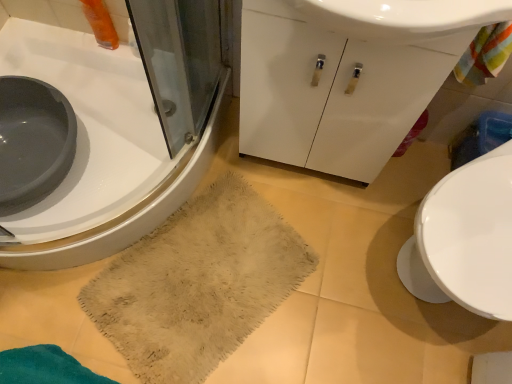
Question: Is white glossy cabinet at center at the back of white glossy sink at lower left?

Choices:
 (A) no
 (B) yes

Answer: (A)

Question: Could you tell me if white glossy sink at lower left is turned towards white glossy cabinet at center?

Choices:
 (A) yes
 (B) no

Answer: (B)

Question: From the image's perspective, is white glossy sink at lower left below white glossy cabinet at center?

Choices:
 (A) yes
 (B) no

Answer: (A)

Question: From a real-world perspective, is white glossy sink at lower left below white glossy cabinet at center?

Choices:
 (A) yes
 (B) no

Answer: (A)

Question: Does white glossy sink at lower left have a smaller size compared to white glossy cabinet at center?

Choices:
 (A) yes
 (B) no

Answer: (B)

Question: Considering the relative positions of white glossy sink at lower left and white glossy cabinet at center in the image provided, is white glossy sink at lower left to the right of white glossy cabinet at center from the viewer's perspective?

Choices:
 (A) yes
 (B) no

Answer: (B)

Question: Is beige fuzzy rug at lower center outside white glossy cabinet at center?

Choices:
 (A) yes
 (B) no

Answer: (A)

Question: Considering the relative sizes of beige fuzzy rug at lower center and white glossy cabinet at center in the image provided, is beige fuzzy rug at lower center taller than white glossy cabinet at center?

Choices:
 (A) no
 (B) yes

Answer: (A)

Question: Can you confirm if beige fuzzy rug at lower center is bigger than white glossy cabinet at center?

Choices:
 (A) yes
 (B) no

Answer: (B)

Question: Is beige fuzzy rug at lower center oriented towards white glossy cabinet at center?

Choices:
 (A) yes
 (B) no

Answer: (B)

Question: From the image's perspective, would you say beige fuzzy rug at lower center is shown under white glossy cabinet at center?

Choices:
 (A) no
 (B) yes

Answer: (B)

Question: Does beige fuzzy rug at lower center have a smaller size compared to white glossy cabinet at center?

Choices:
 (A) yes
 (B) no

Answer: (A)

Question: Does beige fuzzy rug at lower center have a larger size compared to white glossy sink at lower left?

Choices:
 (A) no
 (B) yes

Answer: (A)